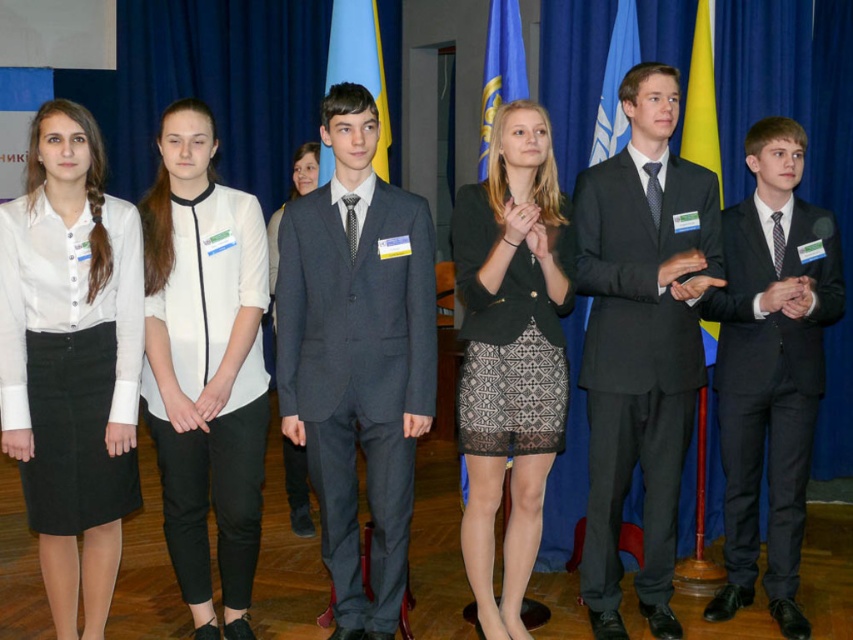
Who is higher up, dark gray suit at center or black lace skirt at center?

dark gray suit at center is above.

Which is behind, point (358, 586) or point (474, 195)?

Positioned behind is point (474, 195).

What do you see at coordinates (357, 356) in the screenshot? I see `dark gray suit at center` at bounding box center [357, 356].

Image resolution: width=853 pixels, height=640 pixels. Find the location of `dark gray suit at center`. dark gray suit at center is located at coordinates (357, 356).

Can you confirm if black wool suit at right is shorter than blue fabric flag at upper center?

No, black wool suit at right is not shorter than blue fabric flag at upper center.

Does point (762, 412) come farther from viewer compared to point (596, 106)?

No, it is in front of (596, 106).

Find the location of `black wool suit at right`. black wool suit at right is located at coordinates (769, 381).

From the picture: Which of these two, dark gray suit at center or matte black suit at center, stands taller?

matte black suit at center

Which is in front, point (323, 310) or point (682, 342)?

Positioned in front is point (323, 310).

Is point (368, 408) more distant than point (635, 257)?

No, it is in front of (635, 257).

Where is `dark gray suit at center`? The width and height of the screenshot is (853, 640). dark gray suit at center is located at coordinates (357, 356).